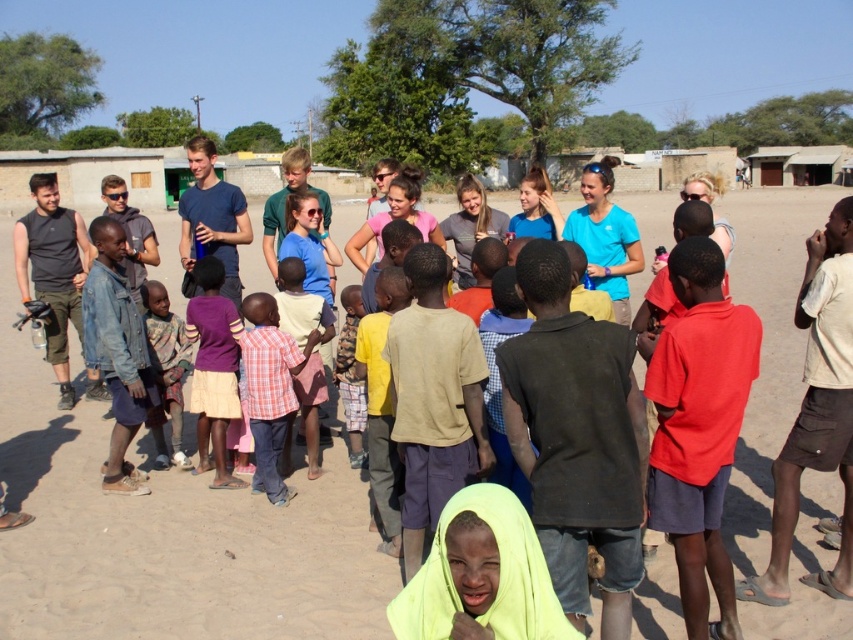
Question: Which of the following is the farthest from the observer?

Choices:
 (A) (202, 314)
 (B) (171, 330)
 (C) (285, 412)

Answer: (B)

Question: Is dirt field at center bigger than knitted sweater at center?

Choices:
 (A) yes
 (B) no

Answer: (A)

Question: Which object is closer to the camera taking this photo?

Choices:
 (A) plaid shirt at center
 (B) purple fabric skirt at center
 (C) dirt field at center

Answer: (C)

Question: Can you confirm if purple fabric skirt at center is smaller than plaid shirt at center?

Choices:
 (A) no
 (B) yes

Answer: (A)

Question: Which object appears farthest from the camera in this image?

Choices:
 (A) plaid shirt at center
 (B) purple fabric skirt at center

Answer: (B)

Question: Does dirt field at center appear on the right side of purple fabric skirt at center?

Choices:
 (A) no
 (B) yes

Answer: (A)